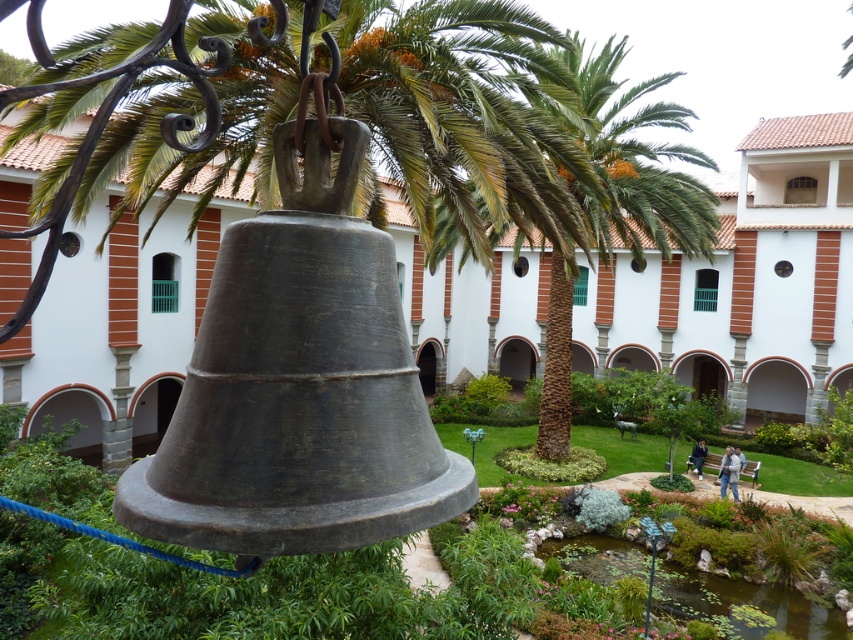
Question: Can you confirm if green leafy palm tree at center is thinner than green lily pads at lower center?

Choices:
 (A) no
 (B) yes

Answer: (A)

Question: Does green leafy palm tree at center appear under green lily pads at lower center?

Choices:
 (A) yes
 (B) no

Answer: (B)

Question: Which point appears farthest from the camera in this image?

Choices:
 (A) (718, 579)
 (B) (544, 358)

Answer: (B)

Question: Does green leafy palm tree at center have a smaller size compared to green lily pads at lower center?

Choices:
 (A) no
 (B) yes

Answer: (A)